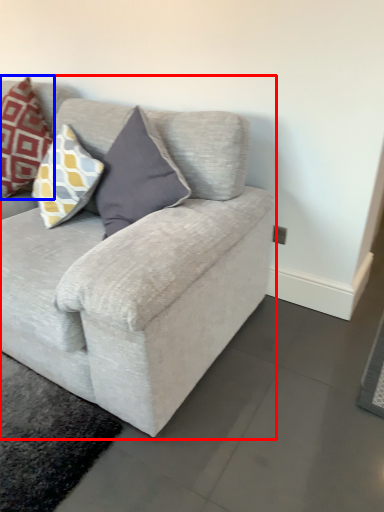
Question: Which of the following is the closest to the observer, studio couch (highlighted by a red box) or pillow (highlighted by a blue box)?

Choices:
 (A) studio couch
 (B) pillow

Answer: (A)